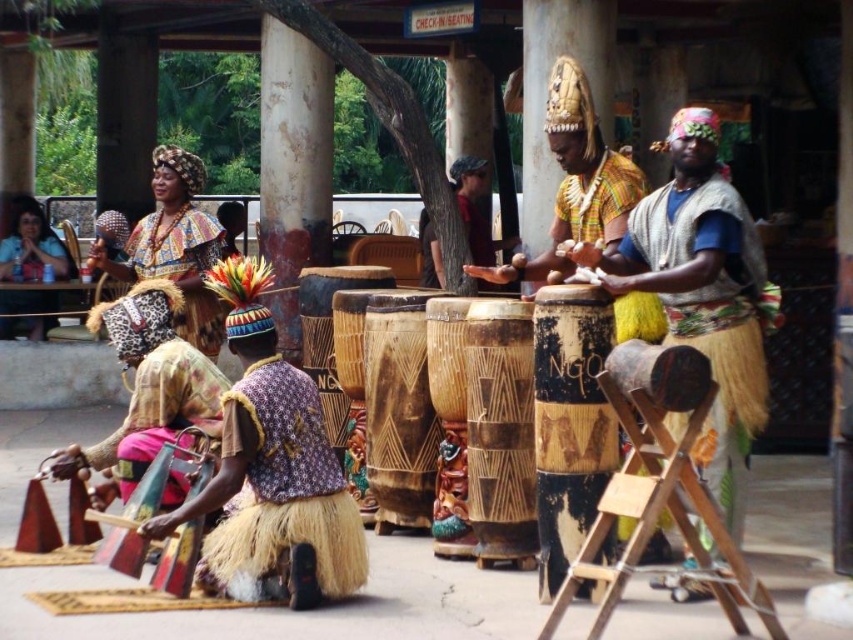
Does point (375, 294) come farther from viewer compared to point (61, 248)?

That is False.

Where is `natural wood drum at center`? natural wood drum at center is located at coordinates (398, 412).

Which is behind, point (389, 298) or point (39, 292)?

Positioned behind is point (39, 292).

Locate an element on the screen. The height and width of the screenshot is (640, 853). natural wood drum at center is located at coordinates (398, 412).

Is point (544, 499) positioned before point (494, 368)?

Yes.

Is black painted wood drum at center to the right of brown textured drum at center from the viewer's perspective?

Yes, black painted wood drum at center is to the right of brown textured drum at center.

This screenshot has height=640, width=853. Describe the element at coordinates (569, 422) in the screenshot. I see `black painted wood drum at center` at that location.

Identify the location of black painted wood drum at center. (569, 422).

Is point (527, 416) positioned in front of point (38, 317)?

Yes, point (527, 416) is closer to viewer.

Does brown textured drum at center appear on the right side of matte blue shirt at left?

Correct, you'll find brown textured drum at center to the right of matte blue shirt at left.

The width and height of the screenshot is (853, 640). I want to click on brown textured drum at center, so (x=500, y=432).